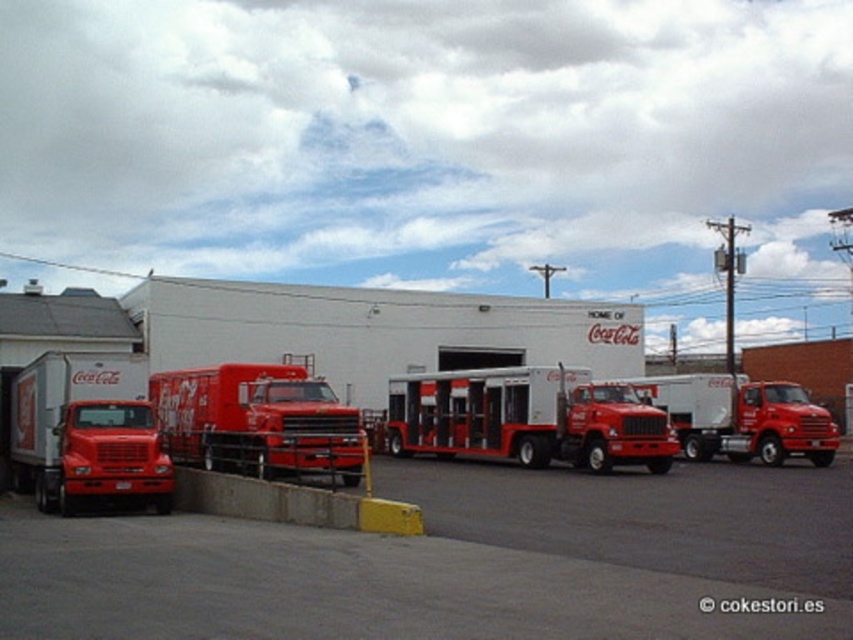
Does shiny red fire truck at center have a lesser width compared to concrete barrier at lower center?

Incorrect, shiny red fire truck at center's width is not less than concrete barrier at lower center's.

Does shiny red fire truck at center appear under concrete barrier at lower center?

No, shiny red fire truck at center is not below concrete barrier at lower center.

The height and width of the screenshot is (640, 853). What are the coordinates of `shiny red fire truck at center` in the screenshot? It's located at (257, 420).

Between matte red truck at left and white glossy trailer at center, which one appears on the right side from the viewer's perspective?

white glossy trailer at center is more to the right.

Does matte red truck at left have a lesser width compared to white glossy trailer at center?

In fact, matte red truck at left might be wider than white glossy trailer at center.

Does point (254, 582) come in front of point (401, 413)?

Yes, it is.

Locate an element on the screen. Image resolution: width=853 pixels, height=640 pixels. matte red truck at left is located at coordinates (456, 563).

Consider the image. Can you confirm if white glossy trailer at center is shorter than shiny red fire truck at center?

Incorrect, white glossy trailer at center's height does not fall short of shiny red fire truck at center's.

Is white glossy trailer at center behind shiny red fire truck at center?

Yes, it is behind shiny red fire truck at center.

At what (x,y) coordinates should I click in order to perform the action: click on white glossy trailer at center. Please return your answer as a coordinate pair (x, y). Image resolution: width=853 pixels, height=640 pixels. Looking at the image, I should click on (527, 419).